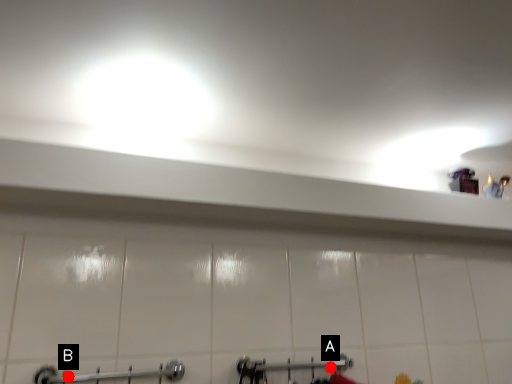
Question: Two points are circled on the image, labeled by A and B beside each circle. Which point is farther from the camera taking this photo?

Choices:
 (A) A is further
 (B) B is further

Answer: (A)